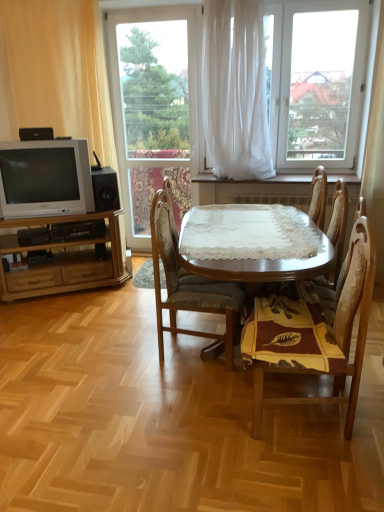
Locate an element on the screen. free spot in front of wooden table at center is located at coordinates (188, 450).